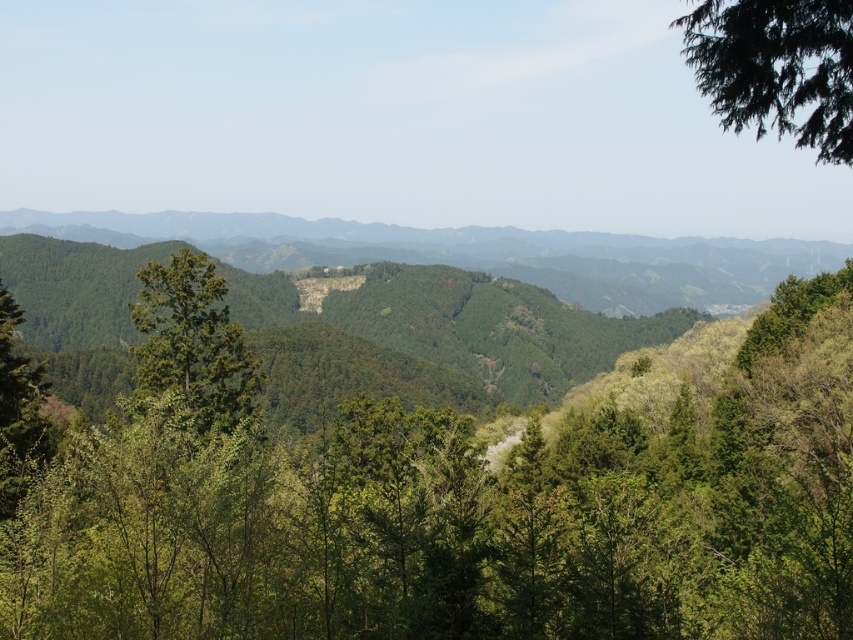
Can you confirm if green leafy tree at center is thinner than green leafy tree at upper right?

Yes.

Is green leafy tree at center below green leafy tree at upper right?

Indeed, green leafy tree at center is positioned under green leafy tree at upper right.

Between point (595, 589) and point (849, 56), which one is positioned behind?

Positioned behind is point (595, 589).

The height and width of the screenshot is (640, 853). I want to click on green leafy tree at center, so click(469, 509).

Is point (723, 372) closer to camera compared to point (183, 298)?

No, it is behind (183, 298).

Consider the image. Is green leafy tree at center bigger than green matte tree at center?

Yes.

Identify the location of green leafy tree at center. This screenshot has height=640, width=853. (469, 509).

The height and width of the screenshot is (640, 853). I want to click on green leafy tree at center, so click(469, 509).

Can you confirm if green leafy tree at upper right is thinner than green matte tree at center?

In fact, green leafy tree at upper right might be wider than green matte tree at center.

Describe the element at coordinates (776, 67) in the screenshot. I see `green leafy tree at upper right` at that location.

Locate an element on the screen. green leafy tree at upper right is located at coordinates (776, 67).